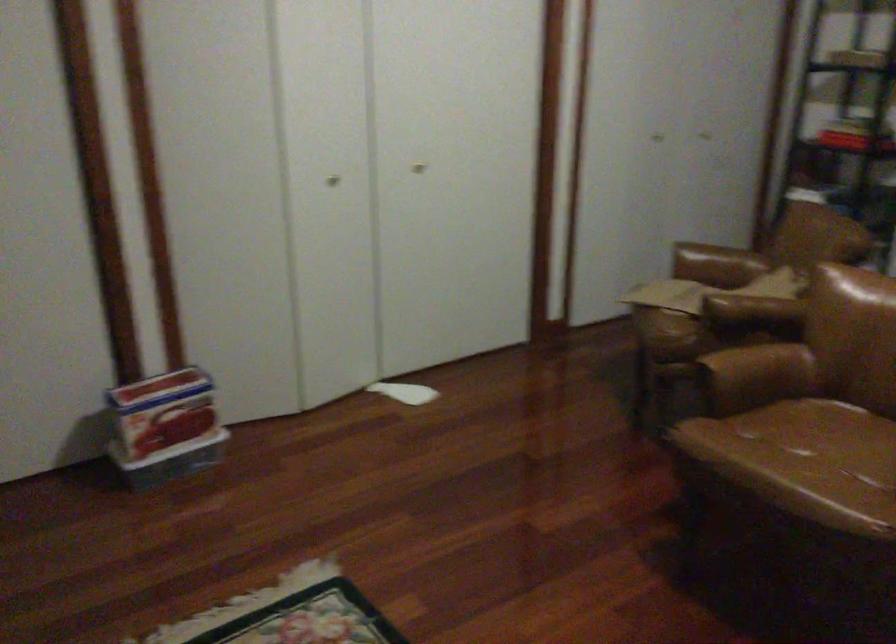
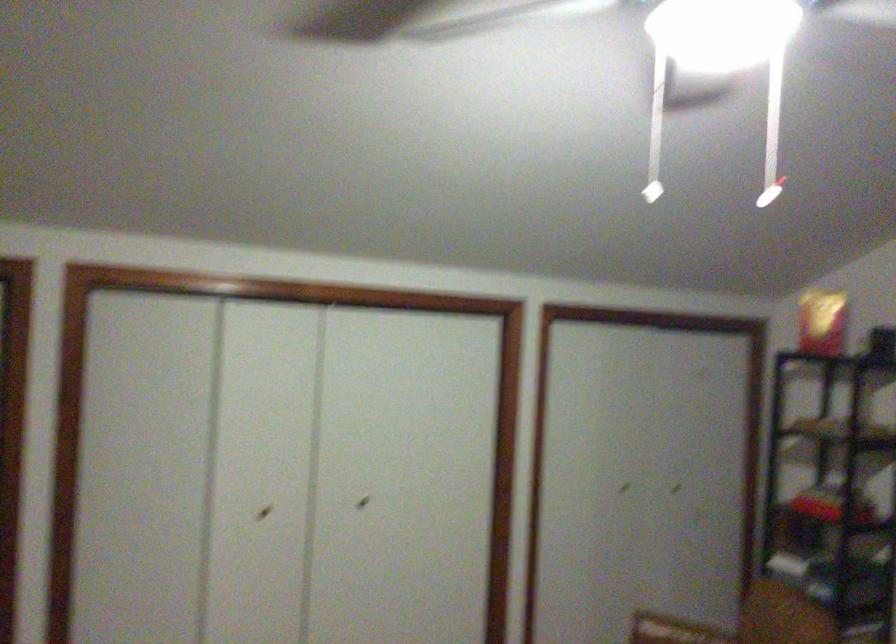
Find the pixel in the second image that matches [426,158] in the first image.

(363, 502)